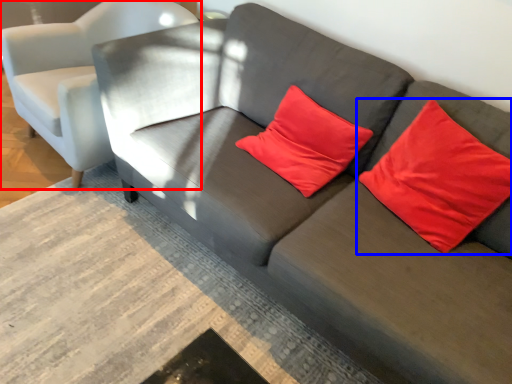
Question: Which of the following is the farthest to the observer, chair (highlighted by a red box) or pillow (highlighted by a blue box)?

Choices:
 (A) chair
 (B) pillow

Answer: (A)